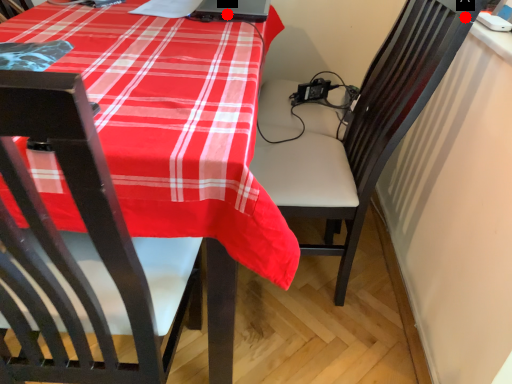
Question: Two points are circled on the image, labeled by A and B beside each circle. Which of the following is the farthest from the observer?

Choices:
 (A) A is further
 (B) B is further

Answer: (B)